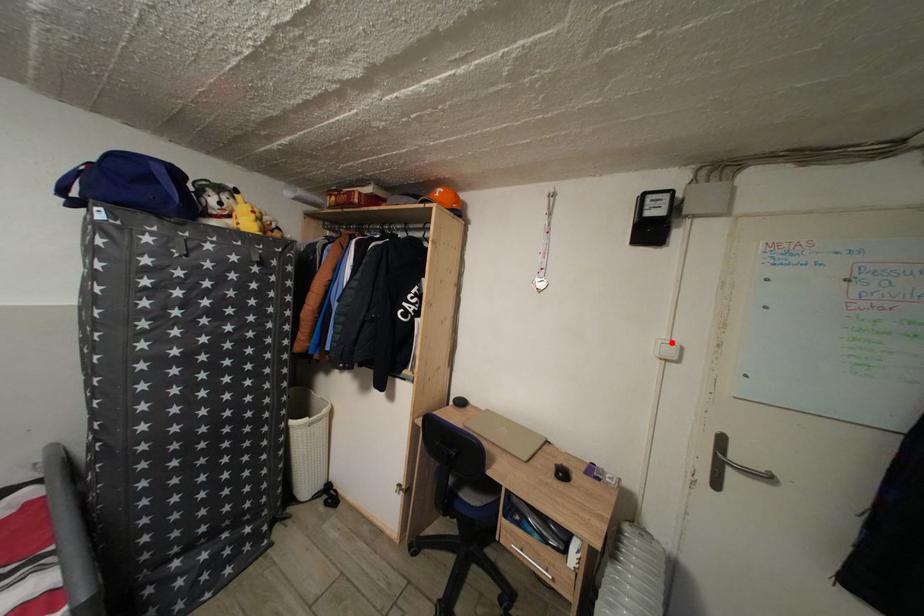
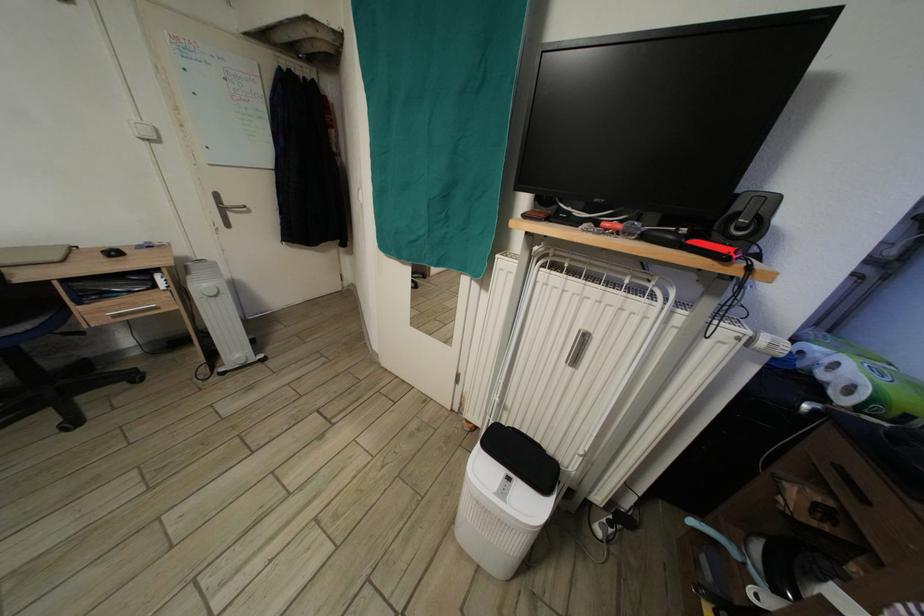
Find the pixel in the second image that matches the highlighted location in the first image.

(141, 124)